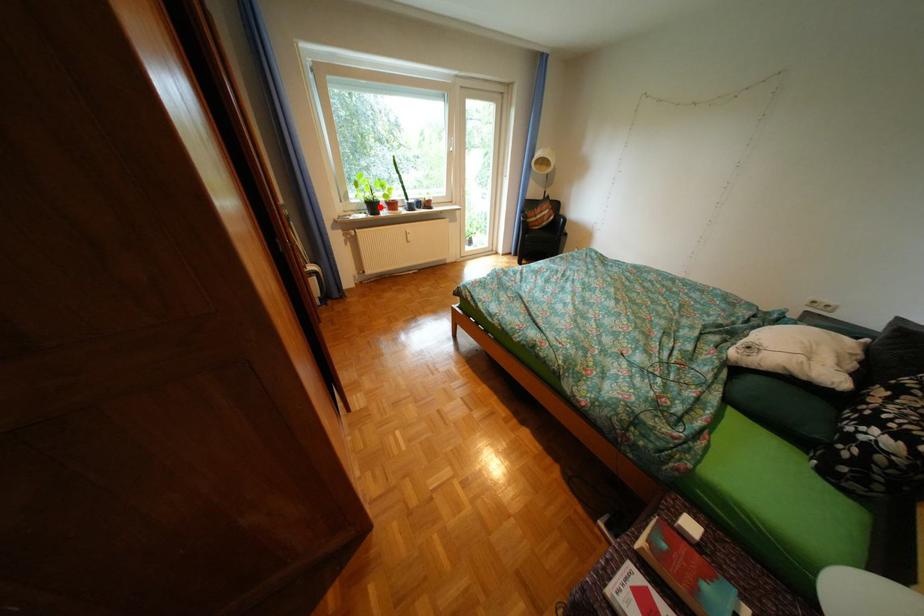
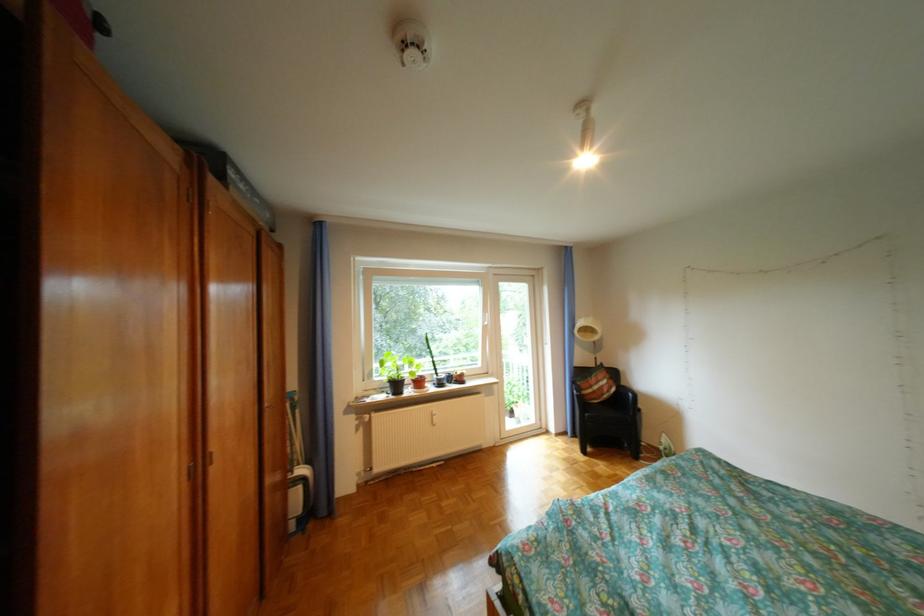
Find the pixel in the second image that matches the highlighted location in the first image.

(403, 386)